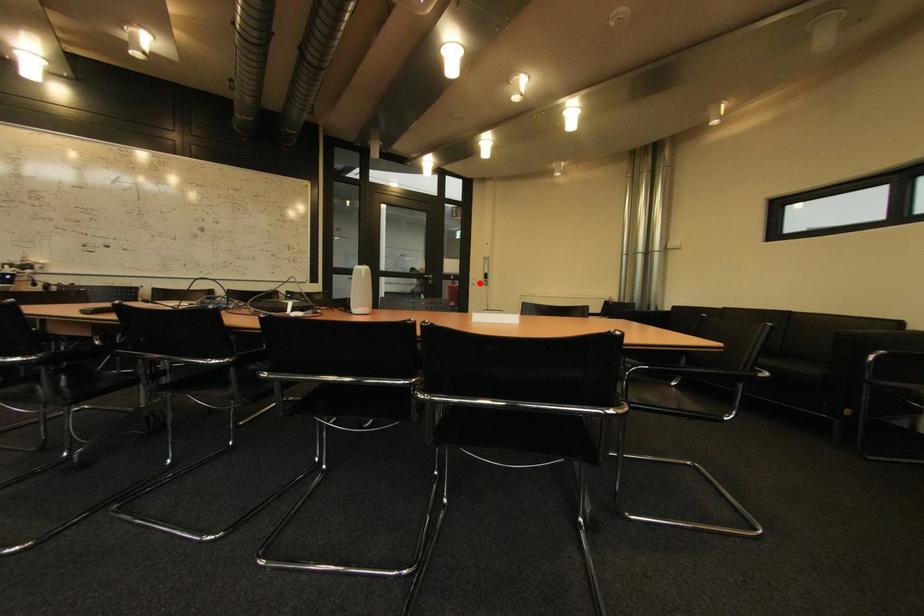
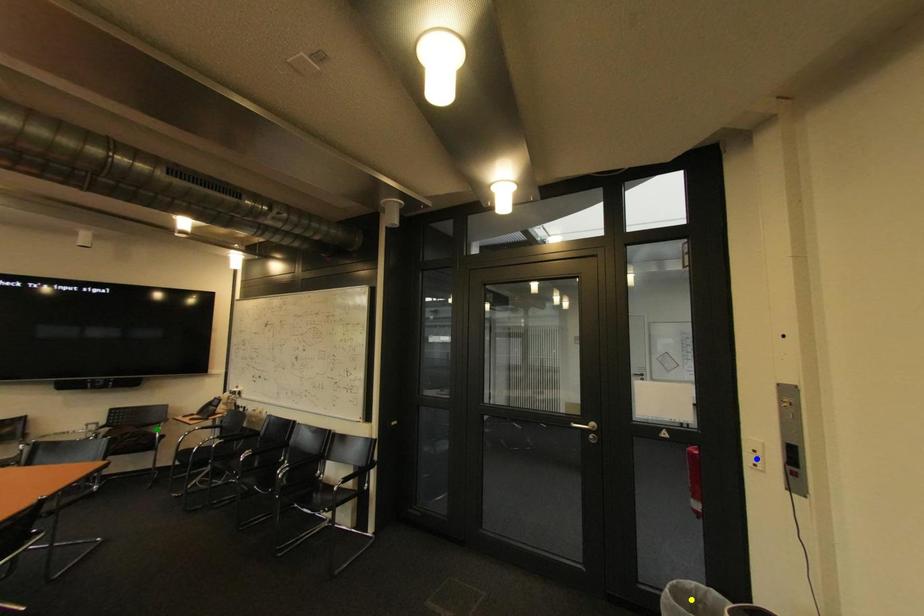
Question: I am providing you with two images of the same scene from different viewpoints. A red point is marked on the first image. You are given multiple points on the second image. Which point in image 2 represents the same 3d spot as the red point in image 1?

Choices:
 (A) blue point
 (B) yellow point
 (C) green point

Answer: (A)